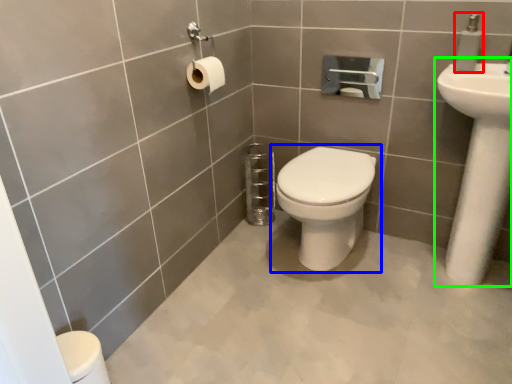
Question: Which object is positioned closest to soap dispenser (highlighted by a red box)? Select from toilet (highlighted by a blue box) and sink (highlighted by a green box).

Choices:
 (A) toilet
 (B) sink

Answer: (B)